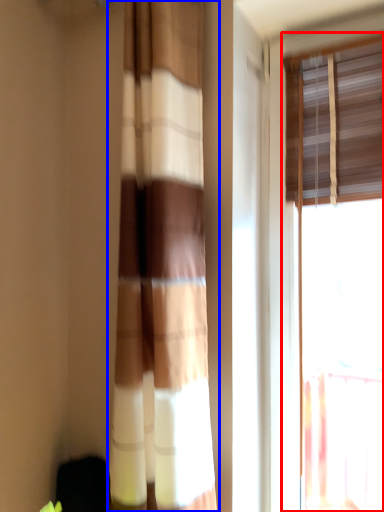
Question: Which point is closer to the camera, window (highlighted by a red box) or curtain (highlighted by a blue box)?

Choices:
 (A) window
 (B) curtain

Answer: (B)